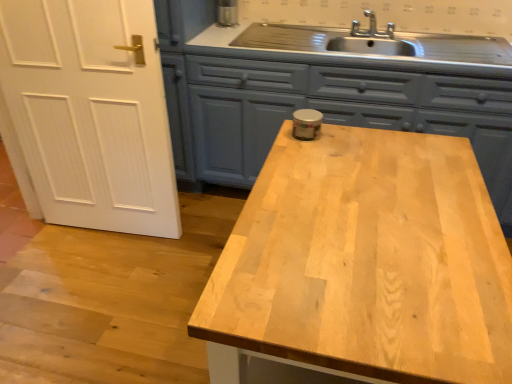
Question: Is matte blue cabinetry at center taller or shorter than light wood countertop at center?

Choices:
 (A) short
 (B) tall

Answer: (B)

Question: Looking at the image, does matte blue cabinetry at center seem bigger or smaller compared to light wood countertop at center?

Choices:
 (A) small
 (B) big

Answer: (B)

Question: Considering the positions of point coord(280,112) and point coord(440,195), is point coord(280,112) closer or farther from the camera than point coord(440,195)?

Choices:
 (A) farther
 (B) closer

Answer: (A)

Question: Is light wood countertop at center situated inside matte blue cabinetry at center or outside?

Choices:
 (A) inside
 (B) outside

Answer: (B)

Question: Considering the positions of light wood countertop at center and matte blue cabinetry at center in the image, is light wood countertop at center bigger or smaller than matte blue cabinetry at center?

Choices:
 (A) small
 (B) big

Answer: (A)

Question: Considering the positions of light wood countertop at center and matte blue cabinetry at center in the image, is light wood countertop at center wider or thinner than matte blue cabinetry at center?

Choices:
 (A) wide
 (B) thin

Answer: (B)

Question: From a real-world perspective, relative to matte blue cabinetry at center, is light wood countertop at center vertically above or below?

Choices:
 (A) above
 (B) below

Answer: (A)